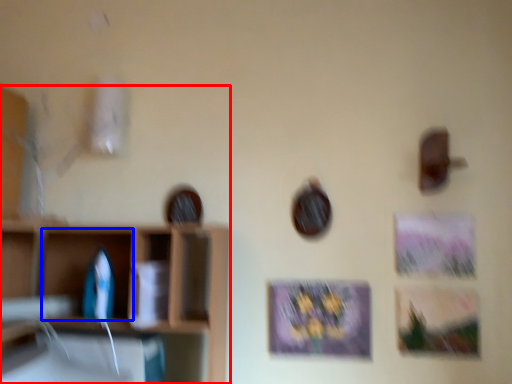
Question: Which object is closer to the camera taking this photo, shelf (highlighted by a red box) or cabinet (highlighted by a blue box)?

Choices:
 (A) shelf
 (B) cabinet

Answer: (A)